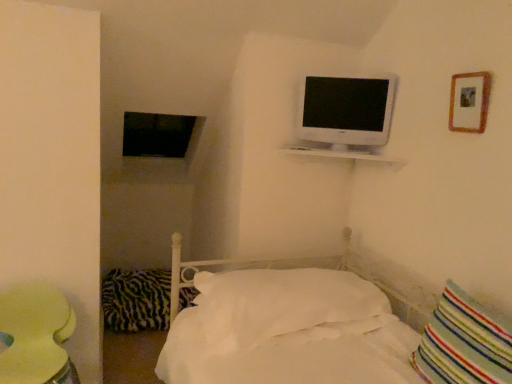
Question: Is white glossy shelf at upper center bigger or smaller than striped fabric pillow at lower right, the third pillow positioned from the left?

Choices:
 (A) big
 (B) small

Answer: (B)

Question: Looking at their shapes, would you say white glossy shelf at upper center is wider or thinner than striped fabric pillow at lower right, which is the third pillow in back-to-front order?

Choices:
 (A) wide
 (B) thin

Answer: (A)

Question: Which is farther from the white glossy television at upper right?

Choices:
 (A) matte yellow table at lower left
 (B) striped fabric pillow at lower right, the 1th pillow in the right-to-left sequence
 (C) white soft pillow at center, placed as the second pillow when sorted from right to left
 (D) zebra-patterned fabric pillow at lower left, which is counted as the 1th pillow, starting from the back
 (E) white glossy shelf at upper center

Answer: (D)

Question: Estimate the real-world distances between objects in this image. Which object is farther from the zebra-patterned fabric pillow at lower left, which is counted as the 1th pillow, starting from the back?

Choices:
 (A) matte yellow table at lower left
 (B) white soft pillow at center, which is the second pillow from front to back
 (C) white glossy shelf at upper center
 (D) wooden picture frame at upper right
 (E) white glossy television at upper right

Answer: (D)